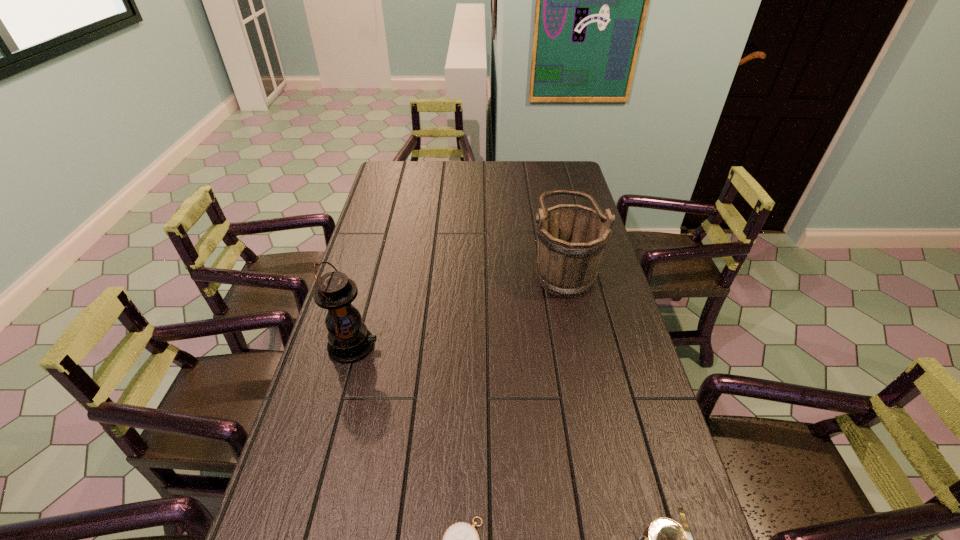
This screenshot has height=540, width=960. What are the coordinates of `vacant area at the far edge of the desktop` in the screenshot? It's located at (472, 172).

Where is `vacant region at the left edge of the desktop`? The width and height of the screenshot is (960, 540). vacant region at the left edge of the desktop is located at coordinates (398, 230).

Find the location of a particular element. The width and height of the screenshot is (960, 540). free space at the right edge of the desktop is located at coordinates (654, 477).

The width and height of the screenshot is (960, 540). I want to click on free space at the far left corner of the desktop, so click(x=416, y=170).

This screenshot has width=960, height=540. In the image, there is a desktop. Find the location of `blank space at the far right corner`. blank space at the far right corner is located at coordinates (562, 161).

At what (x,y) coordinates should I click in order to perform the action: click on blank region between the farthest object and the tallest object. Please return your answer as a coordinate pair (x, y). The height and width of the screenshot is (540, 960). Looking at the image, I should click on (458, 307).

Identify which object is located as the second nearest to the right compass. Please provide its 2D coordinates. Your answer should be formatted as a tuple, i.e. [(x, y)], where the tuple contains the x and y coordinates of a point satisfying the conditions above.

[(571, 239)]

Point out which object is positioned as the third nearest to the farthest object. Please provide its 2D coordinates. Your answer should be formatted as a tuple, i.e. [(x, y)], where the tuple contains the x and y coordinates of a point satisfying the conditions above.

[(461, 539)]